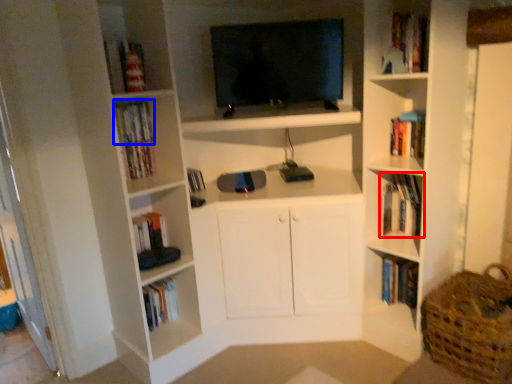
Question: Which of the following is the closest to the observer, book (highlighted by a red box) or book (highlighted by a blue box)?

Choices:
 (A) book
 (B) book

Answer: (B)